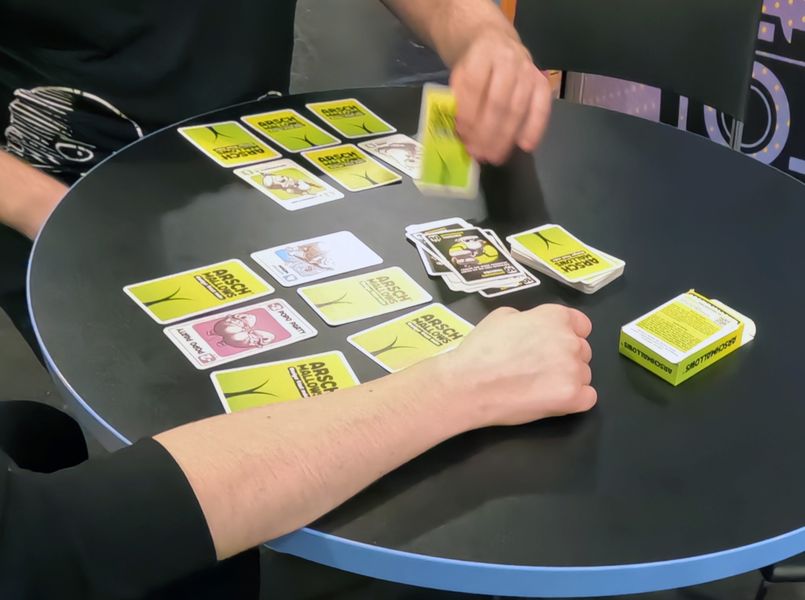
At what (x,y) coordinates should I click in order to perform the action: click on empty chair. Please return your answer as a coordinate pair (x, y). This screenshot has height=600, width=805. Looking at the image, I should click on (708, 42).